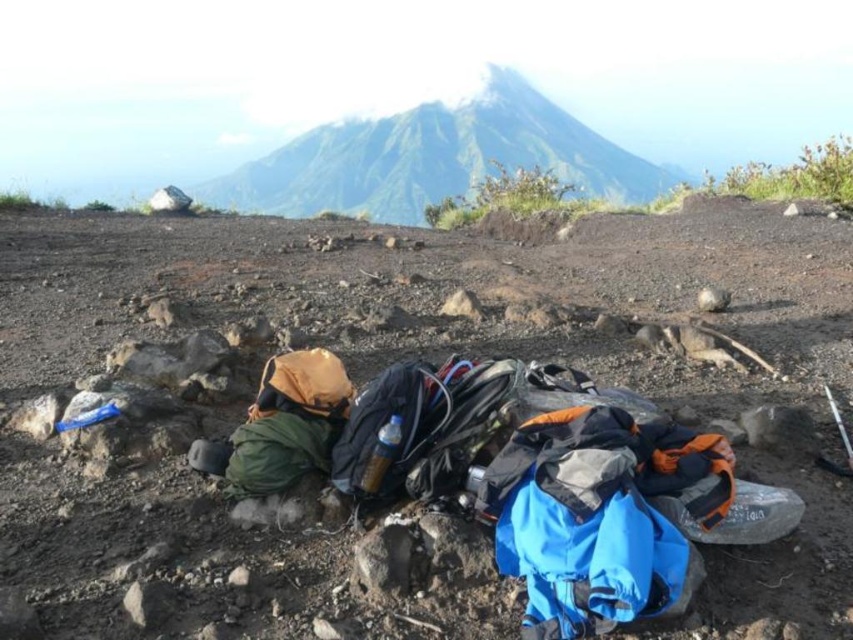
Does dull gray rock at center come in front of smooth gray mountain at upper center?

Yes, it is in front of smooth gray mountain at upper center.

Which is below, dull gray rock at center or smooth gray mountain at upper center?

dull gray rock at center is below.

Which is in front, point (62, 584) or point (476, 99)?

Point (62, 584) is in front.

You are a GUI agent. You are given a task and a screenshot of the screen. Output one action in this format:
    pyautogui.click(x=<x>, y=<y>)
    Task: Click on the dull gray rock at center
    Image resolution: width=853 pixels, height=640 pixels.
    Given the screenshot: What is the action you would take?
    pyautogui.click(x=439, y=296)